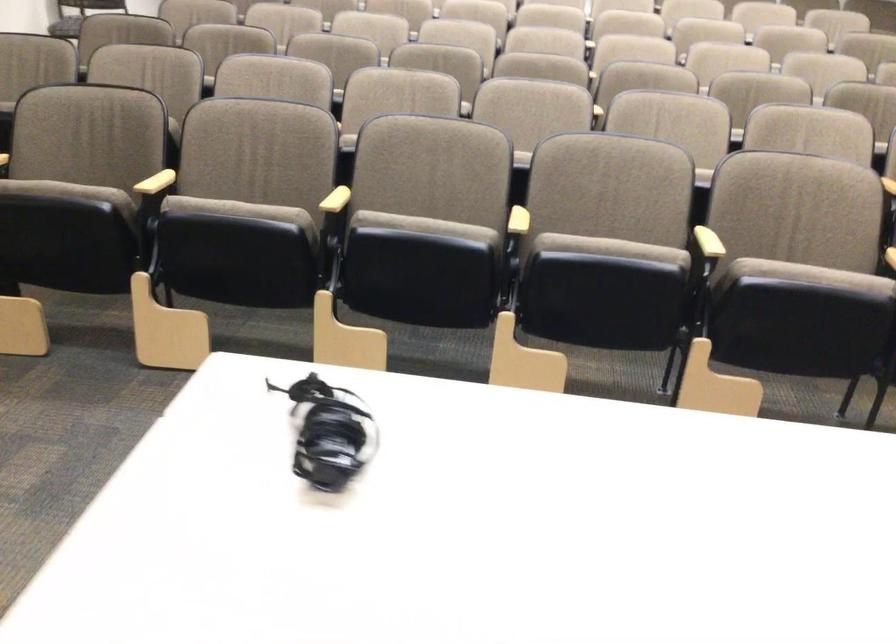
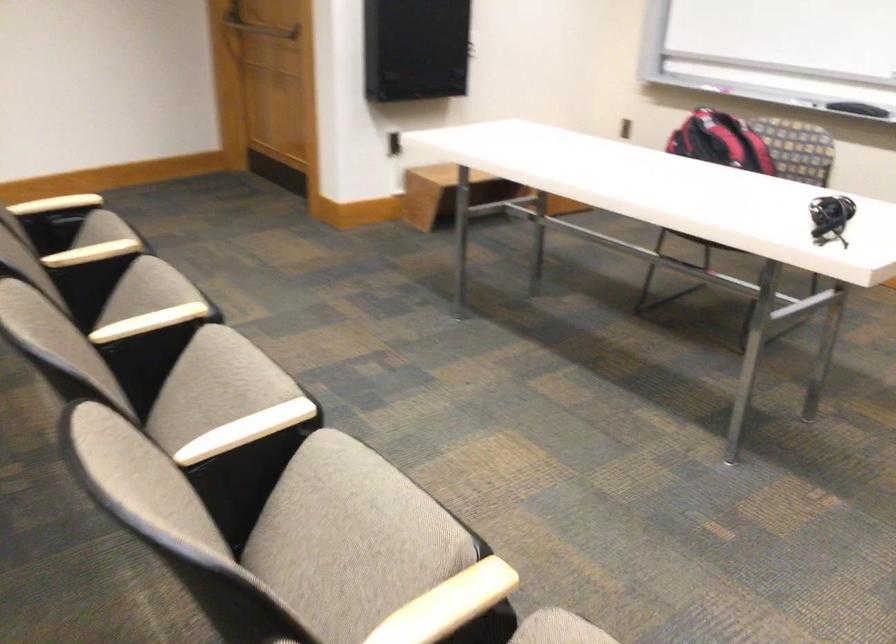
In the second image, find the point that corresponds to point 251,388 in the first image.

(830, 218)